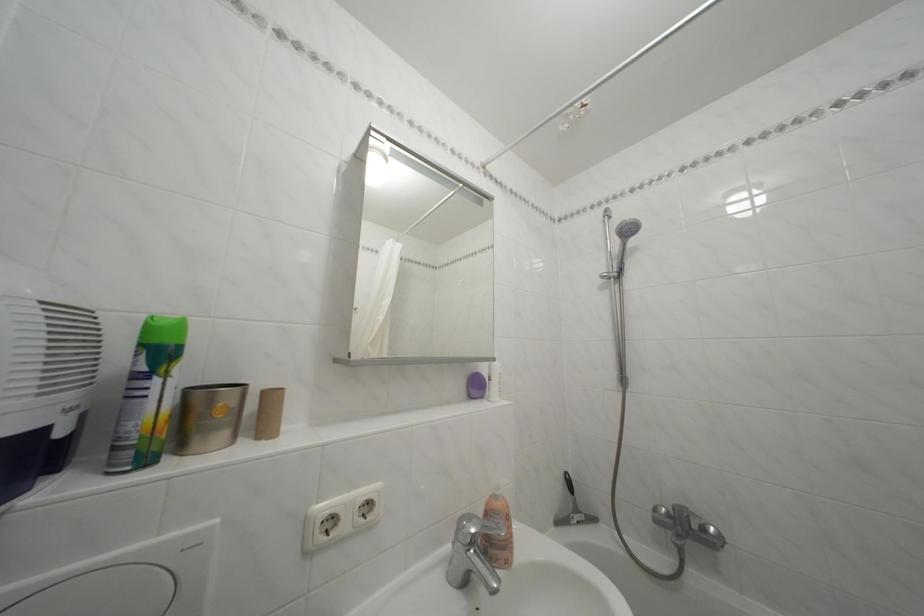
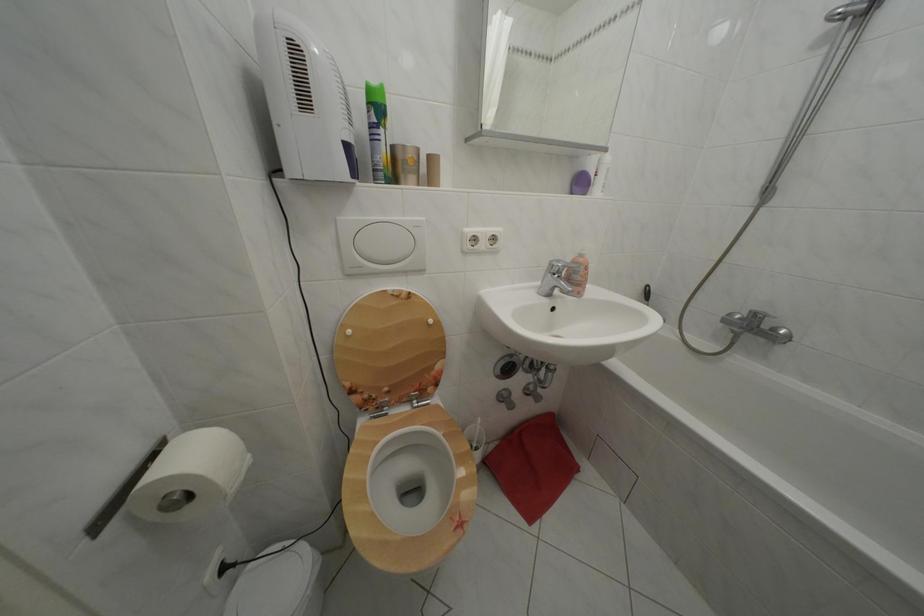
In the second image, find the point that corresponds to (479,525) in the first image.

(567, 268)